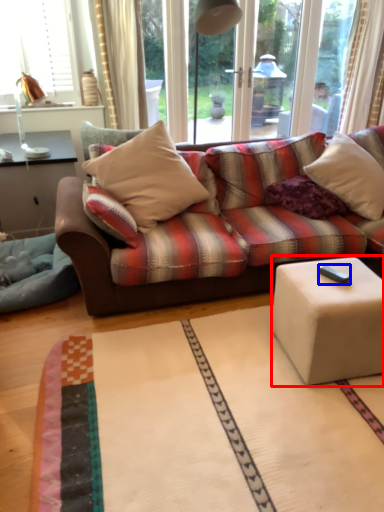
Question: Which of the following is the farthest to the observer, table (highlighted by a red box) or remote control (highlighted by a blue box)?

Choices:
 (A) table
 (B) remote control

Answer: (B)